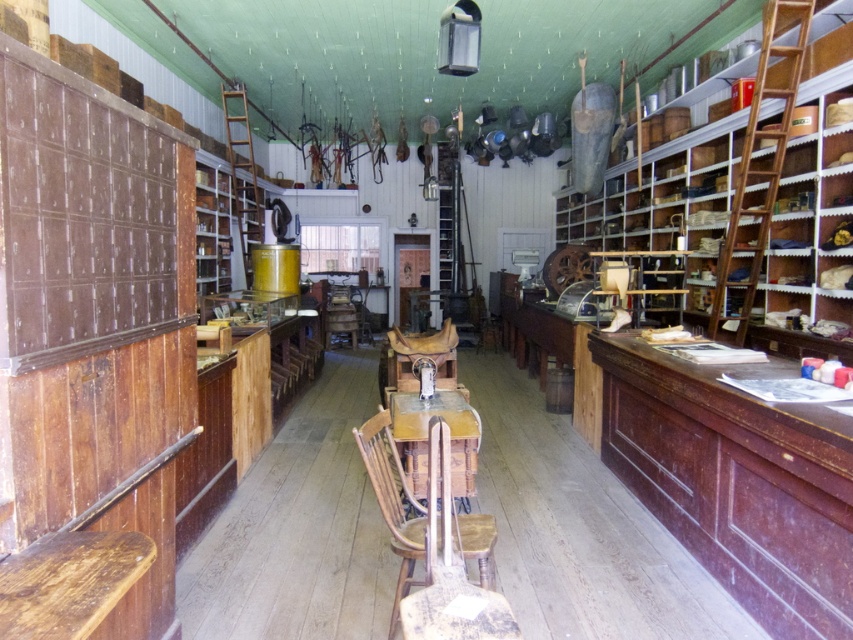
You are standing in the vintage store and need to sit down. Is the wooden chair at center located near the center of the room?

The wooden chair at center is located at point (393, 502), which is near the center of the room.

You are a customer in this store and want to sit down. Which object, the wooden chair at center or the wooden table at center, should you approach to sit?

The wooden chair at center is positioned under the wooden table at center, so you should approach the wooden chair at center to sit.